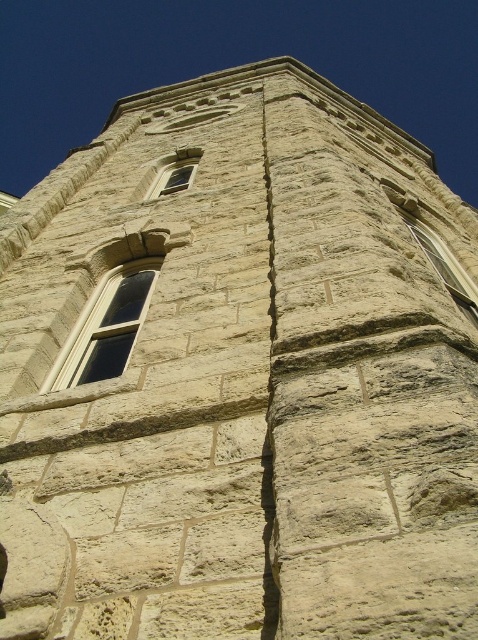
What do you see at coordinates (106, 326) in the screenshot?
I see `clear glass window at center` at bounding box center [106, 326].

Is clear glass window at center below clear stone window at upper right?

Yes, clear glass window at center is below clear stone window at upper right.

Does point (128, 316) lie in front of point (456, 275)?

That is True.

This screenshot has width=478, height=640. Identify the location of clear glass window at center. (106, 326).

Which is in front, point (123, 323) or point (185, 160)?

Point (123, 323) is in front.

Looking at this image, is the position of clear glass window at center more distant than that of matte stone window at upper center?

No.

Is point (97, 301) behind point (181, 164)?

That is False.

Locate an element on the screen. Image resolution: width=478 pixels, height=640 pixels. clear glass window at center is located at coordinates (106, 326).

Who is more forward, (419,225) or (167,186)?

Point (419,225) is in front.

Identify the location of clear stone window at upper right. The width and height of the screenshot is (478, 640). (445, 268).